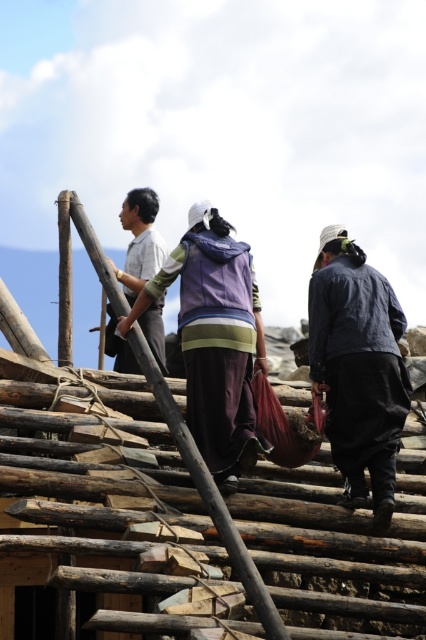
Question: Among these objects, which one is farthest from the camera?

Choices:
 (A) purple fabric at center
 (B) light gray striped shirt at upper left
 (C) wooden at center
 (D) dark blue fabric at center

Answer: (B)

Question: Estimate the real-world distances between objects in this image. Which object is farther from the light gray striped shirt at upper left?

Choices:
 (A) wooden at center
 (B) dark blue fabric at center

Answer: (B)

Question: Is dark blue fabric at center to the left of wooden at center from the viewer's perspective?

Choices:
 (A) yes
 (B) no

Answer: (B)

Question: Is wooden at center bigger than light gray striped shirt at upper left?

Choices:
 (A) yes
 (B) no

Answer: (A)

Question: Is dark blue fabric at center to the left of light gray striped shirt at upper left from the viewer's perspective?

Choices:
 (A) no
 (B) yes

Answer: (A)

Question: Which object is farther from the camera taking this photo?

Choices:
 (A) wooden at center
 (B) light gray striped shirt at upper left

Answer: (B)